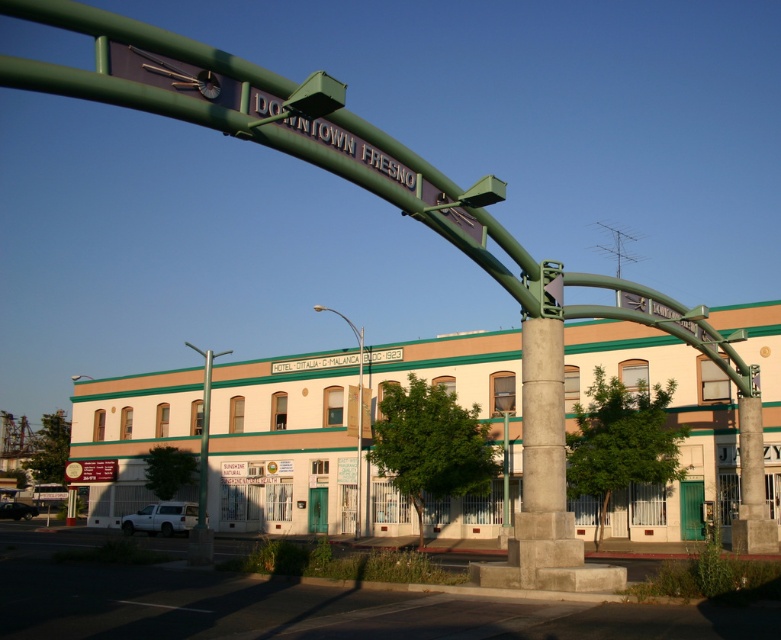
Is metallic pole at center positioned before metallic street light at lower left?

Yes, metallic pole at center is closer to the viewer.

At what (x,y) coordinates should I click in order to perform the action: click on metallic pole at center. Please return your answer as a coordinate pair (x, y). Looking at the image, I should click on pyautogui.click(x=355, y=412).

Who is more forward, (362, 394) or (80, 474)?

Positioned in front is point (362, 394).

Locate an element on the screen. The image size is (781, 640). metallic pole at center is located at coordinates (355, 412).

Between point (202, 438) and point (346, 317), which one is positioned in front?

Point (202, 438) is in front.

In the scene shown: Between green metallic pole at center and metallic pole at center, which one has less height?

Standing shorter between the two is green metallic pole at center.

This screenshot has width=781, height=640. Describe the element at coordinates (202, 474) in the screenshot. I see `green metallic pole at center` at that location.

At what (x,y) coordinates should I click in order to perform the action: click on green metallic pole at center. Please return your answer as a coordinate pair (x, y). The height and width of the screenshot is (640, 781). Looking at the image, I should click on click(202, 474).

Which of these two, green metallic pole at center or metallic street light at lower left, stands taller?

Standing taller between the two is green metallic pole at center.

Which is more to the right, green metallic pole at center or metallic street light at lower left?

green metallic pole at center

Find the location of a particular element. green metallic pole at center is located at coordinates (202, 474).